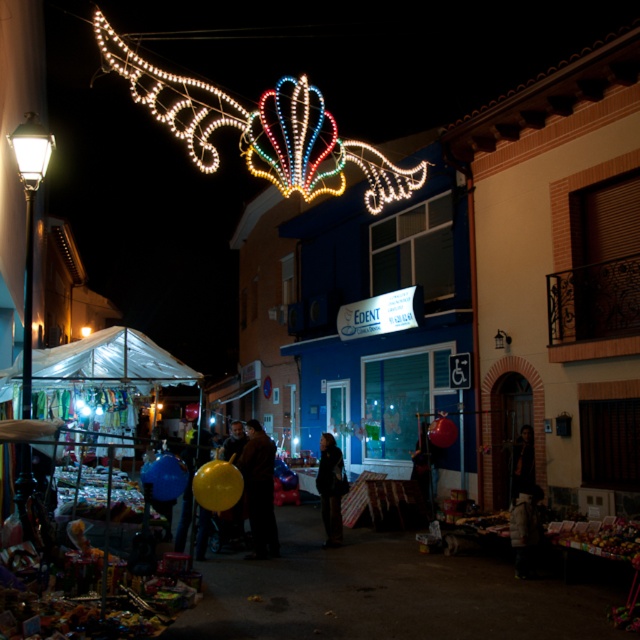
Question: Estimate the real-world distances between objects in this image. Which object is closer to the white glass streetlight at left?

Choices:
 (A) smooth yellow balloon at center
 (B) dark blue jacket at center
 (C) transparent plastic canopy at lower left

Answer: (C)

Question: Can you confirm if transparent plastic canopy at lower left is positioned to the right of white glass streetlight at left?

Choices:
 (A) yes
 (B) no

Answer: (B)

Question: Among these objects, which one is farthest from the camera?

Choices:
 (A) white glass streetlight at left
 (B) smooth yellow balloon at center

Answer: (B)

Question: Is smooth yellow balloon at center smaller than white glass streetlight at left?

Choices:
 (A) no
 (B) yes

Answer: (A)

Question: Can you confirm if transparent plastic canopy at lower left is thinner than dark blue jacket at center?

Choices:
 (A) no
 (B) yes

Answer: (A)

Question: Estimate the real-world distances between objects in this image. Which object is closer to the smooth yellow balloon at center?

Choices:
 (A) dark blue jacket at center
 (B) transparent plastic canopy at lower left
 (C) white glass streetlight at left
 (D) illuminated plastic shell at upper center

Answer: (A)